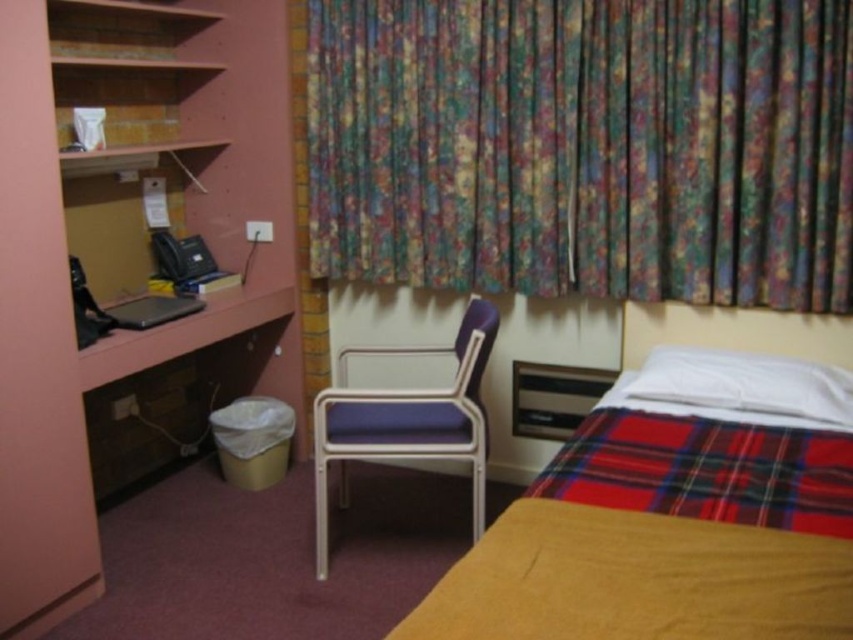
Question: Can you confirm if floral fabric curtain at upper center is thinner than purple fabric chair at center?

Choices:
 (A) yes
 (B) no

Answer: (B)

Question: Is matte pink bookshelf at left wider than purple fabric chair at center?

Choices:
 (A) yes
 (B) no

Answer: (B)

Question: Which point appears closest to the camera in this image?

Choices:
 (A) (581, 483)
 (B) (717, 298)
 (C) (447, 448)

Answer: (A)

Question: Does floral fabric curtain at upper center have a smaller size compared to matte pink bookshelf at left?

Choices:
 (A) no
 (B) yes

Answer: (B)

Question: Which is farther from the matte pink bookshelf at left?

Choices:
 (A) plaid fabric blanket at lower right
 (B) purple fabric chair at center
 (C) plaid fabric bed at lower right

Answer: (A)

Question: Which point is closer to the camera taking this photo?

Choices:
 (A) (693, 348)
 (B) (761, 490)
 (C) (601, 278)
 (D) (399, 451)

Answer: (B)